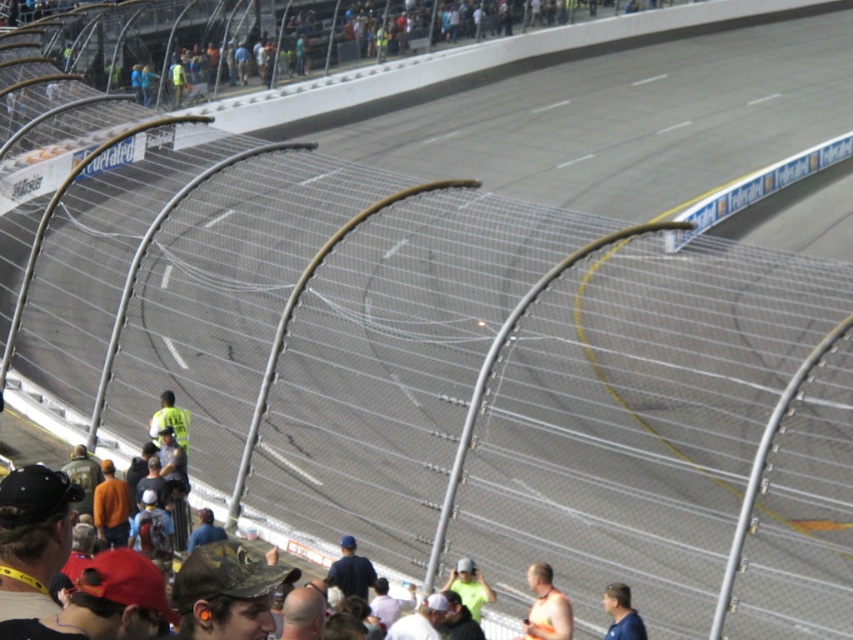
Is blue shirt at lower center to the left of green fabric cap at center from the viewer's perspective?

Incorrect, blue shirt at lower center is not on the left side of green fabric cap at center.

Is point (628, 628) farther from camera compared to point (473, 566)?

No.

You are a GUI agent. You are given a task and a screenshot of the screen. Output one action in this format:
    pyautogui.click(x=<x>, y=<y>)
    Task: Click on the blue shirt at lower center
    This screenshot has width=853, height=640.
    Given the screenshot: What is the action you would take?
    [x=621, y=612]

Locate an element on the screen. blue shirt at lower center is located at coordinates (621, 612).

Does point (531, 614) come closer to viewer compared to point (473, 564)?

Yes, it is.

Which is more to the right, orange reflective vest at center or green fabric cap at center?

orange reflective vest at center is more to the right.

What do you see at coordinates (546, 608) in the screenshot? The width and height of the screenshot is (853, 640). I see `orange reflective vest at center` at bounding box center [546, 608].

Where is `orange reflective vest at center`? The height and width of the screenshot is (640, 853). orange reflective vest at center is located at coordinates 546,608.

Identify the location of orange reflective vest at center. (546, 608).

Which is in front, point (558, 621) or point (619, 611)?

Point (619, 611) is more forward.

Locate an element on the screen. orange reflective vest at center is located at coordinates (546, 608).